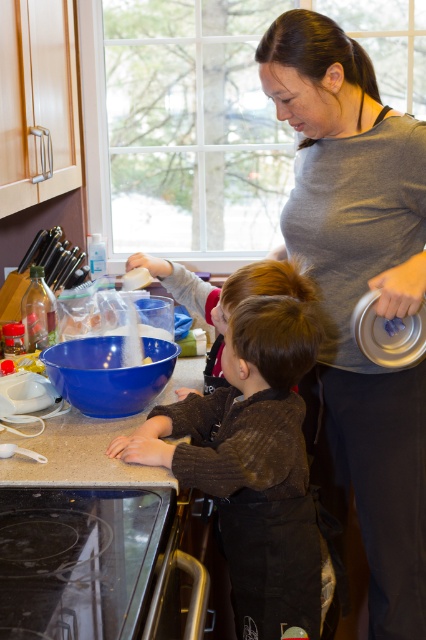
From the picture: You are a chef standing in front of the kitchen counter. You need to reach the blue plastic bowl at center to mix ingredients. Can you comfortably reach it without moving your position?

The blue plastic bowl at center is 4.53 feet away from the viewer. Since this distance is within typical comfortable reaching range for most adults, yes, you can comfortably reach it without moving your position.

You are trying to place a large cutting board on the smooth granite countertop at lower center. Considering the smooth brown hair at center is present, can the countertop accommodate the board without overlapping the hair?

The smooth granite countertop at lower center has a width less than the smooth brown hair at center, so placing the cutting board might cause it to overlap the hair since the countertop isn

You are a chef standing in the kitchen and want to place a heavy pot on the smooth granite countertop at lower center. However, there is a person with smooth brown hair at center nearby. Based on the scene, will placing the pot on the countertop block the person from seeing the window outside?

Result: The smooth granite countertop at lower center is in front of the smooth brown hair at center, so placing the pot on the countertop would block the person from seeing the window outside.